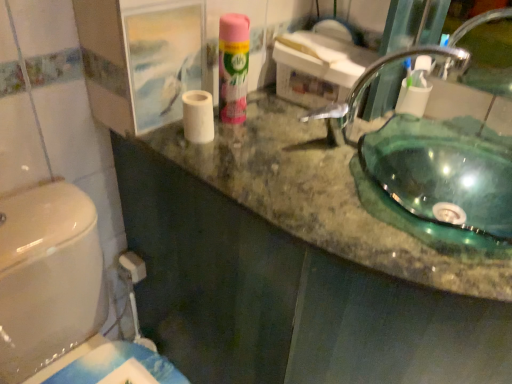
Locate an element on the screen. This screenshot has width=512, height=384. vacant area that lies to the right of white matte toilet paper at center, the 1th toilet paper from the left is located at coordinates [x=273, y=144].